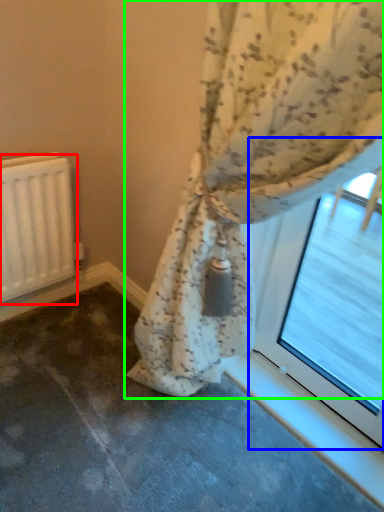
Question: Estimate the real-world distances between objects in this image. Which object is closer to radiator (highlighted by a red box), bay window (highlighted by a blue box) or curtain (highlighted by a green box)?

Choices:
 (A) bay window
 (B) curtain

Answer: (B)